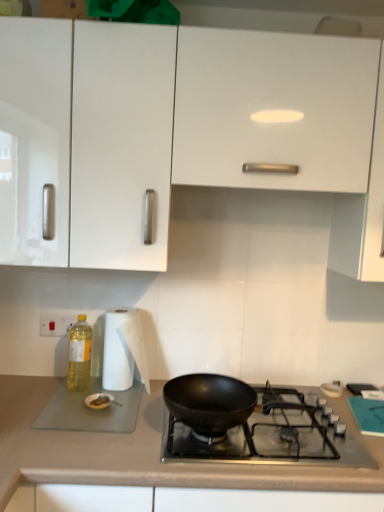
Question: Is black matte wok at center oriented away from white paper towel at left?

Choices:
 (A) yes
 (B) no

Answer: (B)

Question: Does black matte wok at center have a greater width compared to white paper towel at left?

Choices:
 (A) no
 (B) yes

Answer: (B)

Question: Does black matte wok at center appear on the left side of white paper towel at left?

Choices:
 (A) yes
 (B) no

Answer: (B)

Question: Can you confirm if black matte wok at center is smaller than white paper towel at left?

Choices:
 (A) yes
 (B) no

Answer: (B)

Question: From the image's perspective, is black matte wok at center over white paper towel at left?

Choices:
 (A) no
 (B) yes

Answer: (A)

Question: From the image's perspective, is white paper towel at left positioned above or below smooth beige countertop at lower center?

Choices:
 (A) below
 (B) above

Answer: (B)

Question: Does point (127, 366) appear closer or farther from the camera than point (178, 468)?

Choices:
 (A) closer
 (B) farther

Answer: (B)

Question: Considering their positions, is white paper towel at left located in front of or behind smooth beige countertop at lower center?

Choices:
 (A) behind
 (B) front

Answer: (A)

Question: Considering the positions of white paper towel at left and smooth beige countertop at lower center in the image, is white paper towel at left bigger or smaller than smooth beige countertop at lower center?

Choices:
 (A) big
 (B) small

Answer: (B)

Question: Is white glossy cabinet at upper center in front of or behind yellow translucent bottle at left in the image?

Choices:
 (A) front
 (B) behind

Answer: (A)

Question: Based on their positions, is white glossy cabinet at upper center located to the left or right of yellow translucent bottle at left?

Choices:
 (A) left
 (B) right

Answer: (B)

Question: Looking at the image, does white glossy cabinet at upper center seem bigger or smaller compared to yellow translucent bottle at left?

Choices:
 (A) small
 (B) big

Answer: (B)

Question: From a real-world perspective, is white glossy cabinet at upper center above or below yellow translucent bottle at left?

Choices:
 (A) above
 (B) below

Answer: (A)

Question: Looking at the image, does yellow translucent bottle at left seem bigger or smaller compared to black matte wok at center?

Choices:
 (A) small
 (B) big

Answer: (A)

Question: Relative to black matte wok at center, is yellow translucent bottle at left in front or behind?

Choices:
 (A) front
 (B) behind

Answer: (B)